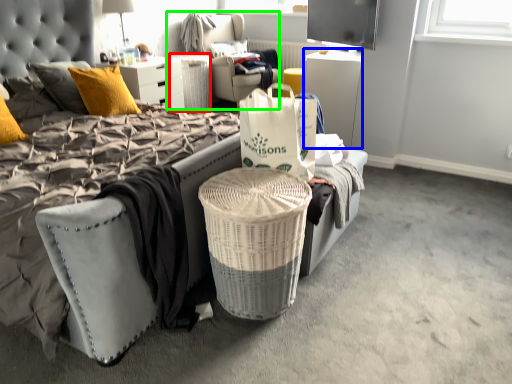
Question: Which object is the closest to the trash bin/can (highlighted by a red box)? Choose among these: desk (highlighted by a blue box) or bean bag chair (highlighted by a green box).

Choices:
 (A) desk
 (B) bean bag chair

Answer: (B)